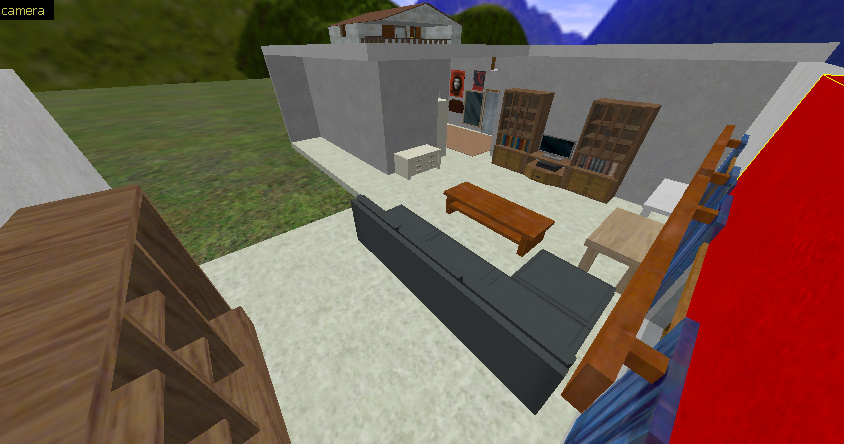
Identify the location of shelf. (149, 391).